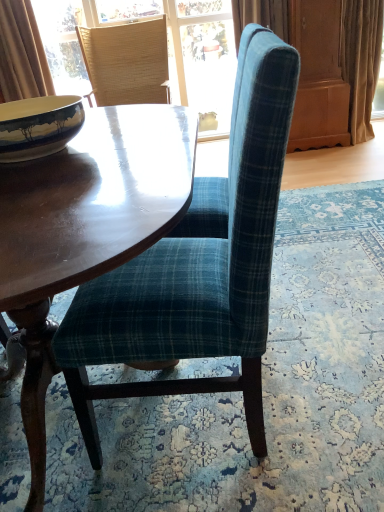
Question: From the image's perspective, is beige fabric curtain at right, placed as the 1th curtain when sorted from right to left, located above matte ceramic bowl at left?

Choices:
 (A) no
 (B) yes

Answer: (B)

Question: Is beige fabric curtain at right, positioned as the second curtain in left-to-right order, looking in the opposite direction of matte ceramic bowl at left?

Choices:
 (A) yes
 (B) no

Answer: (B)

Question: Does beige fabric curtain at right, placed as the 1th curtain when sorted from right to left, have a lesser width compared to matte ceramic bowl at left?

Choices:
 (A) no
 (B) yes

Answer: (A)

Question: Are beige fabric curtain at right, positioned as the second curtain in left-to-right order, and matte ceramic bowl at left far apart?

Choices:
 (A) yes
 (B) no

Answer: (A)

Question: Is beige fabric curtain at right, positioned as the second curtain in left-to-right order, positioned behind matte ceramic bowl at left?

Choices:
 (A) no
 (B) yes

Answer: (B)

Question: Choose the correct answer: Is woven straw chair at upper left, positioned as the second chair in bottom-to-top order, inside matte ceramic bowl at left or outside it?

Choices:
 (A) outside
 (B) inside

Answer: (A)

Question: Considering the positions of point (99, 100) and point (56, 130), is point (99, 100) closer or farther from the camera than point (56, 130)?

Choices:
 (A) farther
 (B) closer

Answer: (A)

Question: Based on their sizes in the image, would you say woven straw chair at upper left, positioned as the first chair in back-to-front order, is bigger or smaller than matte ceramic bowl at left?

Choices:
 (A) small
 (B) big

Answer: (B)

Question: Is woven straw chair at upper left, positioned as the first chair in back-to-front order, in front of or behind matte ceramic bowl at left in the image?

Choices:
 (A) behind
 (B) front

Answer: (A)

Question: From their relative heights in the image, would you say brown velvet curtain at upper left, the 1th curtain positioned from the left, is taller or shorter than matte ceramic bowl at left?

Choices:
 (A) tall
 (B) short

Answer: (A)

Question: Relative to matte ceramic bowl at left, is brown velvet curtain at upper left, the 1th curtain positioned from the left, in front or behind?

Choices:
 (A) front
 (B) behind

Answer: (B)

Question: Looking at the image, does brown velvet curtain at upper left, the 1th curtain positioned from the left, seem bigger or smaller compared to matte ceramic bowl at left?

Choices:
 (A) small
 (B) big

Answer: (B)

Question: Considering the positions of point (6, 96) and point (44, 138), is point (6, 96) closer or farther from the camera than point (44, 138)?

Choices:
 (A) farther
 (B) closer

Answer: (A)

Question: From the image's perspective, is teal plaid fabric chair at center, the first chair from the front, above or below brown velvet curtain at upper left, the 1th curtain positioned from the left?

Choices:
 (A) below
 (B) above

Answer: (A)

Question: Do you think teal plaid fabric chair at center, the 1th chair in the bottom-to-top sequence, is within brown velvet curtain at upper left, the second curtain viewed from the right, or outside of it?

Choices:
 (A) outside
 (B) inside

Answer: (A)